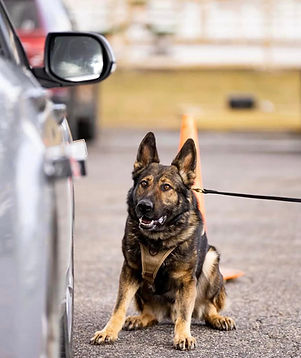
At what (x,y) coordinates should I click in order to perform the action: click on mirror. Please return your answer as a coordinate pair (x, y). This screenshot has width=301, height=358. Looking at the image, I should click on (89, 62).